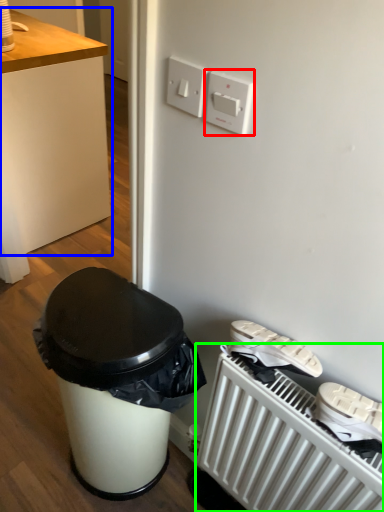
Question: Which object is positioned farthest from light switch (highlighted by a red box)? Select from desk (highlighted by a blue box) and radiator (highlighted by a green box).

Choices:
 (A) desk
 (B) radiator

Answer: (A)